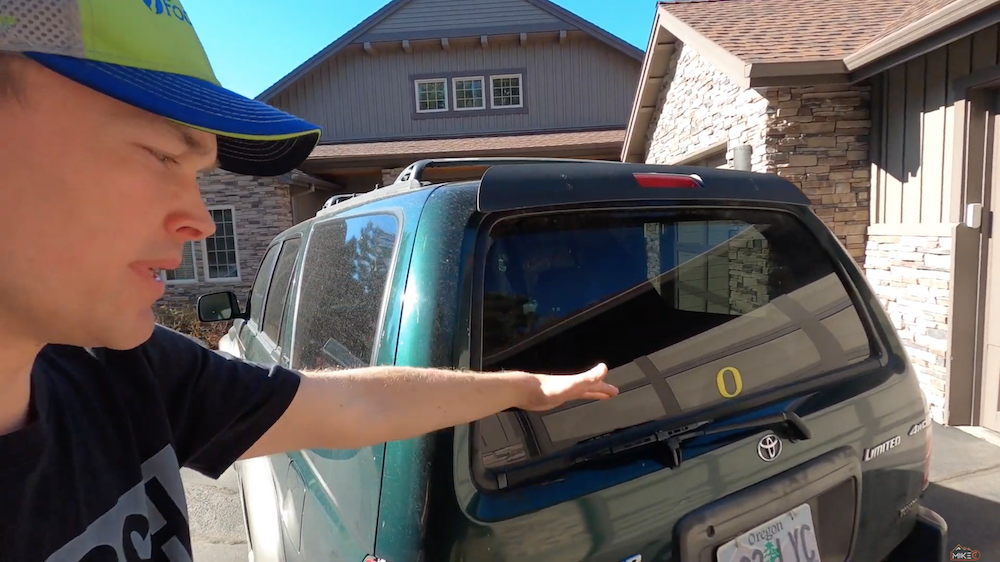
Locate an element on the screen. window is located at coordinates (430, 94), (466, 90), (507, 90), (218, 256), (182, 271).